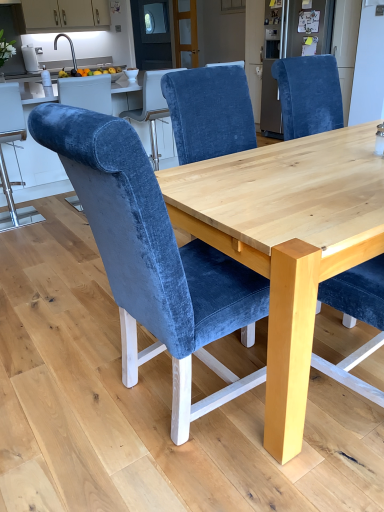
In order to click on spots to the right of velvet blue chair at left, which ranks as the 3th chair in right-to-left order in this screenshot , I will do `click(57, 225)`.